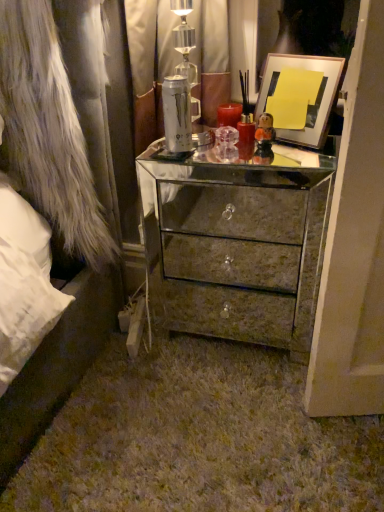
Question: From the image's perspective, does metallic silver picture frame at upper right appear lower than mirrored metallic chest of drawers at center?

Choices:
 (A) no
 (B) yes

Answer: (A)

Question: Does metallic silver picture frame at upper right turn towards mirrored metallic chest of drawers at center?

Choices:
 (A) yes
 (B) no

Answer: (B)

Question: Is metallic silver picture frame at upper right taller than mirrored metallic chest of drawers at center?

Choices:
 (A) no
 (B) yes

Answer: (A)

Question: Does metallic silver picture frame at upper right touch mirrored metallic chest of drawers at center?

Choices:
 (A) yes
 (B) no

Answer: (B)

Question: Does metallic silver picture frame at upper right have a lesser width compared to mirrored metallic chest of drawers at center?

Choices:
 (A) no
 (B) yes

Answer: (B)

Question: Is metallic silver picture frame at upper right to the left of mirrored metallic chest of drawers at center from the viewer's perspective?

Choices:
 (A) no
 (B) yes

Answer: (A)

Question: Considering the relative sizes of metallic silver picture frame at upper right and white fur coat at left in the image provided, is metallic silver picture frame at upper right smaller than white fur coat at left?

Choices:
 (A) yes
 (B) no

Answer: (A)

Question: From a real-world perspective, does metallic silver picture frame at upper right stand above white fur coat at left?

Choices:
 (A) yes
 (B) no

Answer: (A)

Question: Considering the relative sizes of metallic silver picture frame at upper right and white fur coat at left in the image provided, is metallic silver picture frame at upper right taller than white fur coat at left?

Choices:
 (A) no
 (B) yes

Answer: (A)

Question: From a real-world perspective, is metallic silver picture frame at upper right beneath white fur coat at left?

Choices:
 (A) yes
 (B) no

Answer: (B)

Question: Is metallic silver picture frame at upper right to the right of white fur coat at left from the viewer's perspective?

Choices:
 (A) yes
 (B) no

Answer: (A)

Question: Does metallic silver picture frame at upper right have a lesser height compared to white fur coat at left?

Choices:
 (A) yes
 (B) no

Answer: (A)

Question: Is white fur coat at left to the right of metallic silver picture frame at upper right from the viewer's perspective?

Choices:
 (A) no
 (B) yes

Answer: (A)